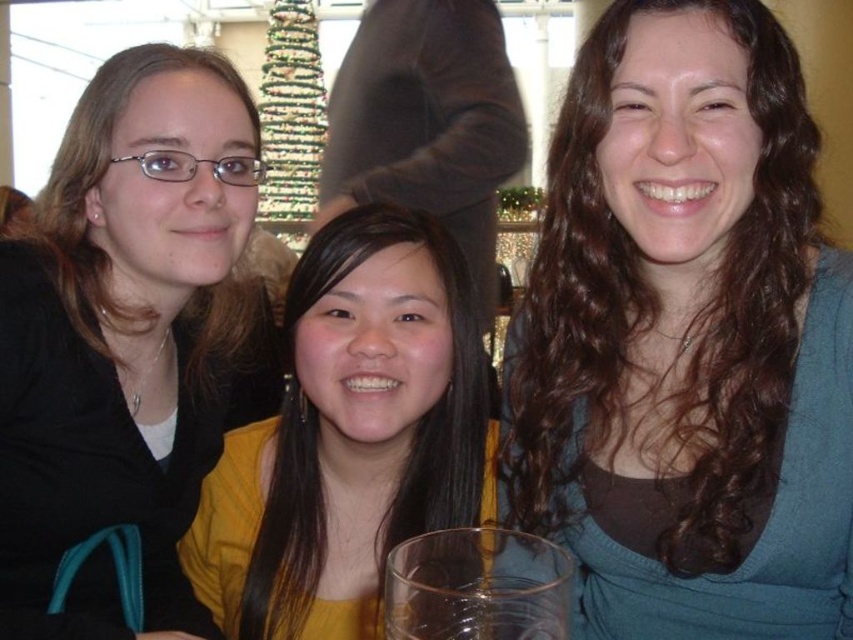
Question: Is matte black hair at left to the right of yellow matte shirt at center from the viewer's perspective?

Choices:
 (A) no
 (B) yes

Answer: (A)

Question: Estimate the real-world distances between objects in this image. Which object is closer to the matte black hair at left?

Choices:
 (A) yellow matte shirt at center
 (B) brown curly hair at center

Answer: (A)

Question: Can you confirm if matte black hair at left is positioned to the right of yellow matte shirt at center?

Choices:
 (A) no
 (B) yes

Answer: (A)

Question: Among these objects, which one is nearest to the camera?

Choices:
 (A) brown curly hair at center
 (B) yellow matte shirt at center

Answer: (A)

Question: Considering the real-world distances, which object is closest to the matte black hair at left?

Choices:
 (A) yellow matte shirt at center
 (B) brown curly hair at center

Answer: (A)

Question: Can you confirm if brown curly hair at center is positioned to the left of matte black hair at left?

Choices:
 (A) yes
 (B) no

Answer: (B)